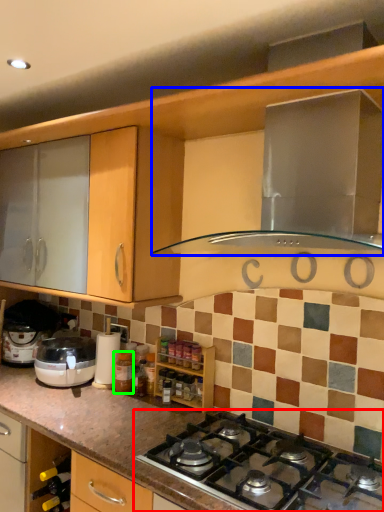
Question: Estimate the real-world distances between objects in this image. Which object is closer to gas stove (highlighted by a red box), home appliance (highlighted by a blue box) or bottle (highlighted by a green box)?

Choices:
 (A) home appliance
 (B) bottle

Answer: (B)